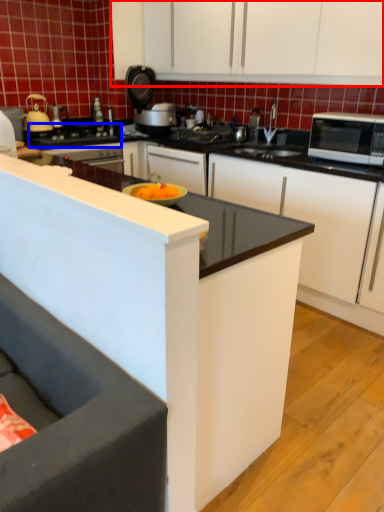
Question: Which of the following is the closest to the observer, cabinetry (highlighted by a red box) or gas stove (highlighted by a blue box)?

Choices:
 (A) cabinetry
 (B) gas stove

Answer: (A)